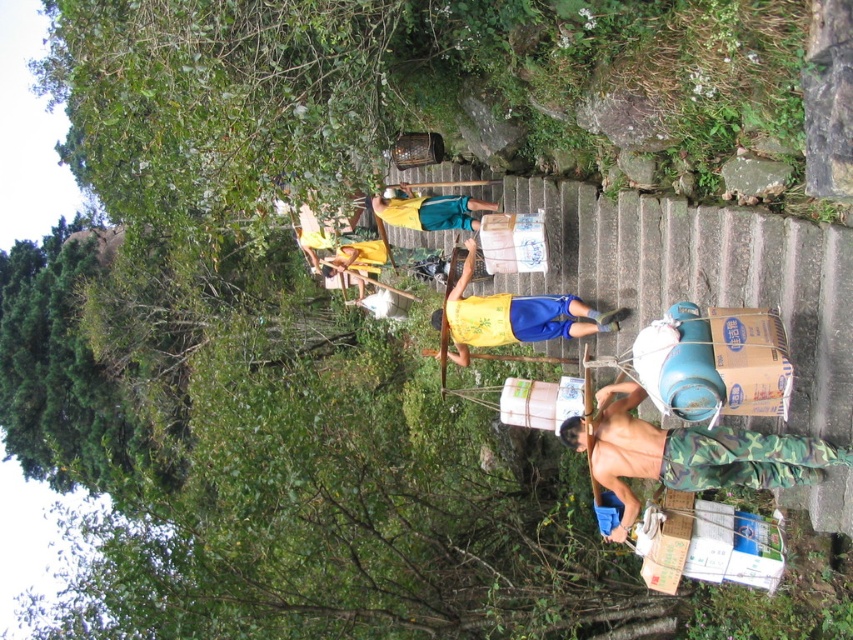
Question: Is yellow fabric shirt at center further to the viewer compared to yellow fabric shirt at upper center?

Choices:
 (A) yes
 (B) no

Answer: (B)

Question: Estimate the real-world distances between objects in this image. Which object is farther from the brown cardboard box at right?

Choices:
 (A) camouflage pants at lower right
 (B) yellow matte shirt at center

Answer: (B)

Question: Can you confirm if brown cardboard box at right is smaller than yellow fabric shirt at upper center?

Choices:
 (A) yes
 (B) no

Answer: (A)

Question: Which point is farther to the camera?

Choices:
 (A) (380, 204)
 (B) (357, 278)
 (C) (706, 314)
 (D) (776, 484)

Answer: (B)

Question: Does yellow matte shirt at center appear on the right side of yellow fabric shirt at center?

Choices:
 (A) no
 (B) yes

Answer: (B)

Question: Considering the real-world distances, which object is farthest from the yellow fabric shirt at center?

Choices:
 (A) yellow fabric shirt at upper center
 (B) brown cardboard box at right
 (C) yellow matte shirt at center
 (D) camouflage pants at lower right

Answer: (B)